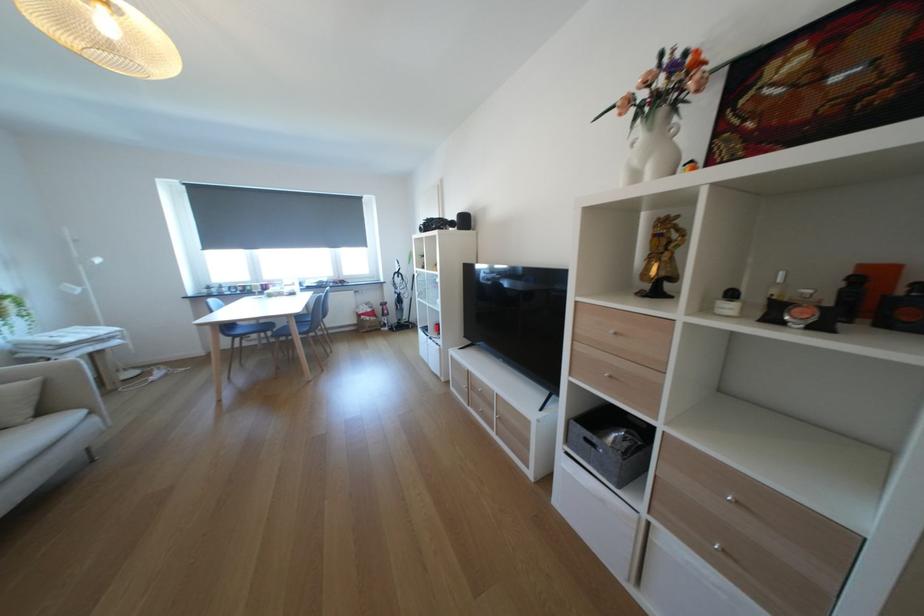
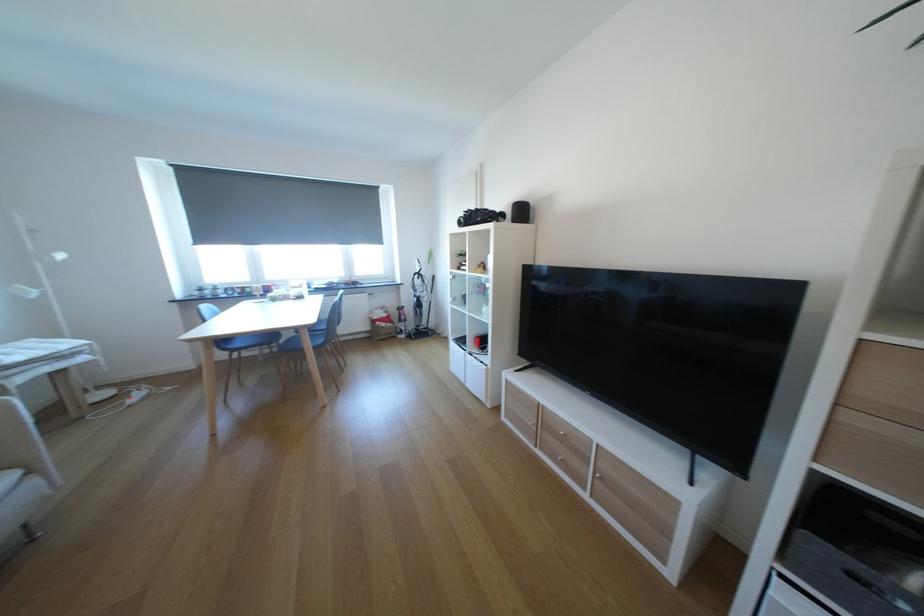
In the second image, find the point that corresponds to the point at 440,227 in the first image.

(480, 219)